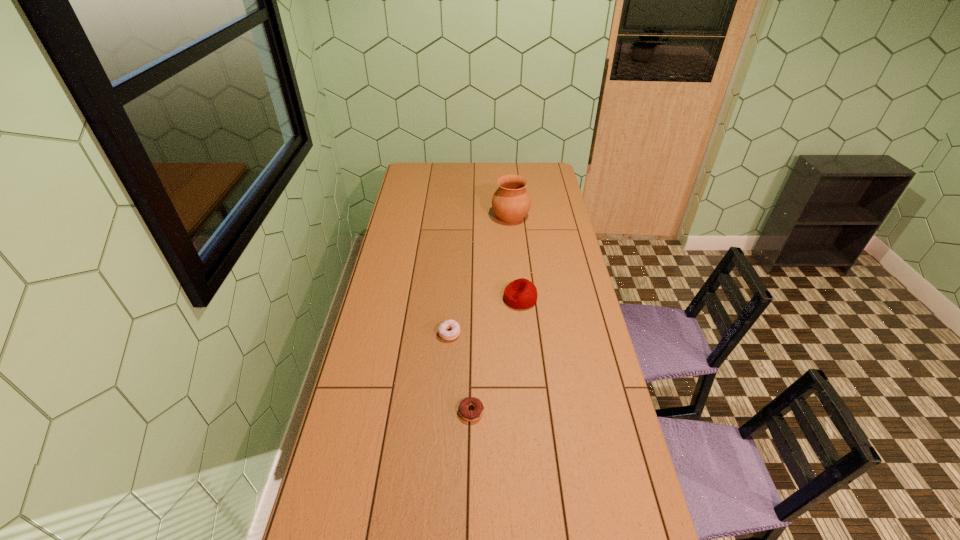
Where is `vacant space that is in between the farthest object and the third object from right to left`? The height and width of the screenshot is (540, 960). vacant space that is in between the farthest object and the third object from right to left is located at coordinates (491, 314).

The height and width of the screenshot is (540, 960). Identify the location of free space between the leftmost object and the farthest object. (480, 275).

Find the location of a particular element. vacant region between the nearest object and the third shortest object is located at coordinates (495, 355).

Identify the location of free space between the left doughnut and the shorter doughnut. (460, 373).

Where is `empty location between the taller doughnut and the third shortest object`? The height and width of the screenshot is (540, 960). empty location between the taller doughnut and the third shortest object is located at coordinates (485, 316).

The image size is (960, 540). Identify the location of free space between the tallest object and the left doughnut. (480, 275).

At what (x,y) coordinates should I click in order to perform the action: click on free area in between the farthest object and the third shortest object. Please return your answer as a coordinate pair (x, y). This screenshot has width=960, height=540. Looking at the image, I should click on (516, 258).

The image size is (960, 540). What are the coordinates of `vacant space that's between the second tallest object and the farther doughnut` in the screenshot? It's located at (485, 316).

You are a GUI agent. You are given a task and a screenshot of the screen. Output one action in this format:
    pyautogui.click(x=<x>, y=<y>)
    Task: Click on the object that is the nearest to the second farthest object
    Image resolution: width=960 pixels, height=540 pixels.
    Given the screenshot: What is the action you would take?
    pyautogui.click(x=448, y=324)

Choose which object is the second nearest neighbor to the third object from right to left. Please provide its 2D coordinates. Your answer should be formatted as a tuple, i.e. [(x, y)], where the tuple contains the x and y coordinates of a point satisfying the conditions above.

[(521, 293)]